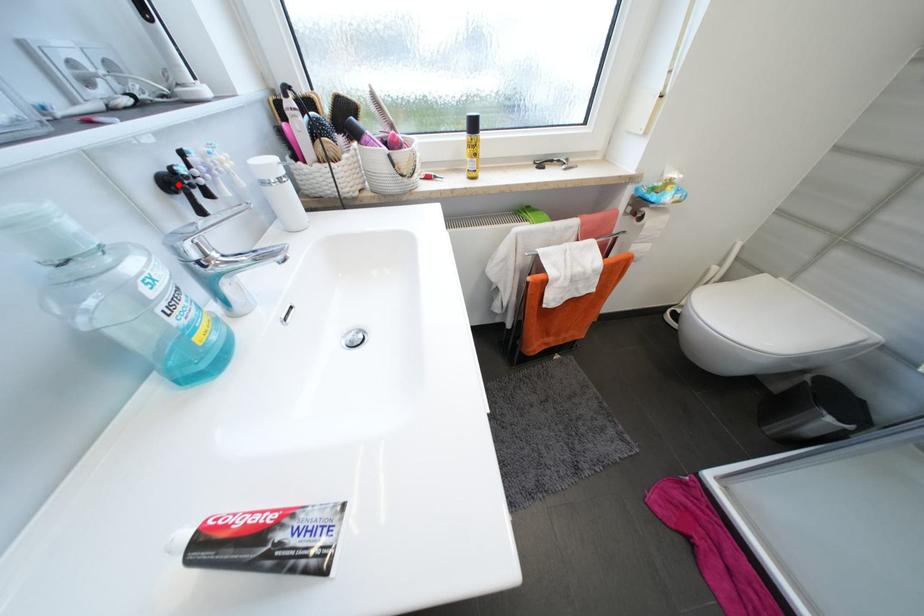
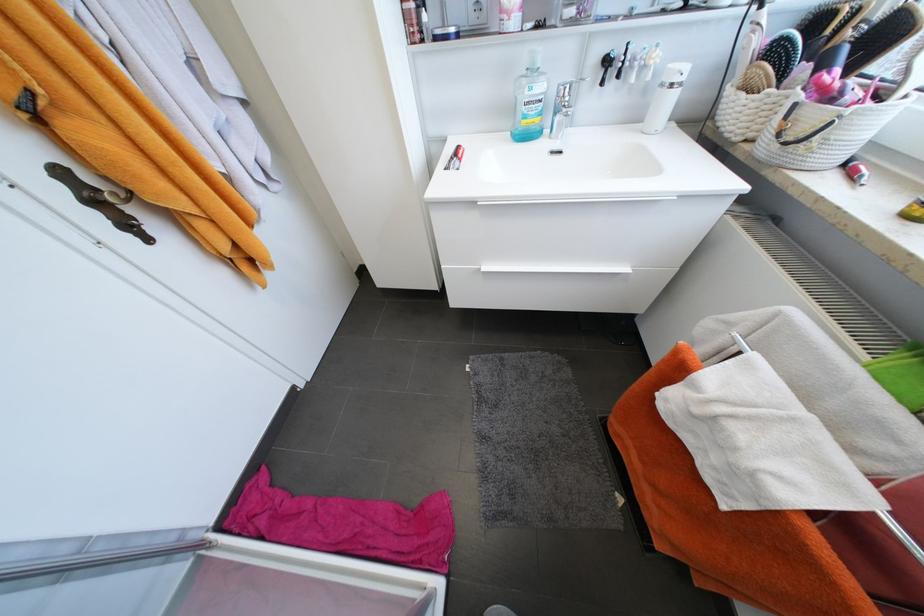
The point at the highlighted location is marked in the first image. Where is the corresponding point in the second image?

(613, 62)